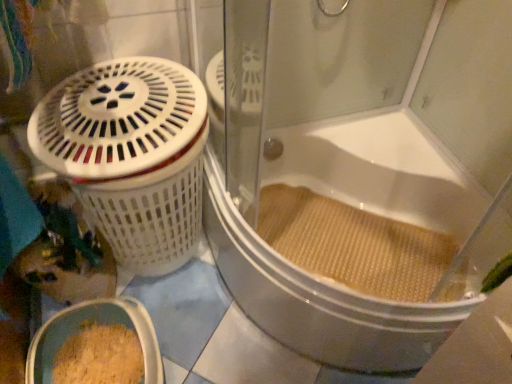
Question: From a real-world perspective, is white textured bathtub at center on white plastic basket at left?

Choices:
 (A) yes
 (B) no

Answer: (A)

Question: Are white textured bathtub at center and white plastic basket at left located far from each other?

Choices:
 (A) yes
 (B) no

Answer: (B)

Question: Does white textured bathtub at center have a larger size compared to white plastic basket at left?

Choices:
 (A) yes
 (B) no

Answer: (A)

Question: From the image's perspective, is white textured bathtub at center located above white plastic basket at left?

Choices:
 (A) yes
 (B) no

Answer: (A)

Question: Considering the relative sizes of white textured bathtub at center and white plastic basket at left in the image provided, is white textured bathtub at center wider than white plastic basket at left?

Choices:
 (A) yes
 (B) no

Answer: (A)

Question: Is white textured bathtub at center bigger or smaller than white plastic basket at left?

Choices:
 (A) big
 (B) small

Answer: (A)

Question: Considering the positions of point (322, 327) and point (170, 165), is point (322, 327) closer or farther from the camera than point (170, 165)?

Choices:
 (A) farther
 (B) closer

Answer: (A)

Question: From a real-world perspective, relative to white plastic basket at left, is white textured bathtub at center vertically above or below?

Choices:
 (A) below
 (B) above

Answer: (B)

Question: From the image's perspective, is white textured bathtub at center positioned above or below white plastic basket at left?

Choices:
 (A) below
 (B) above

Answer: (B)

Question: Does point (108, 170) appear closer or farther from the camera than point (291, 226)?

Choices:
 (A) closer
 (B) farther

Answer: (A)

Question: Which is correct: white plastic basket at left is inside beige textured mat at lower right, or outside of it?

Choices:
 (A) outside
 (B) inside

Answer: (A)

Question: In terms of height, does white plastic basket at left look taller or shorter compared to beige textured mat at lower right?

Choices:
 (A) short
 (B) tall

Answer: (B)

Question: Is white plastic basket at left bigger or smaller than beige textured mat at lower right?

Choices:
 (A) small
 (B) big

Answer: (B)

Question: From a real-world perspective, is beige textured mat at lower right physically located above or below white textured bathtub at center?

Choices:
 (A) above
 (B) below

Answer: (B)

Question: Is point (420, 289) positioned closer to the camera than point (239, 221)?

Choices:
 (A) closer
 (B) farther

Answer: (B)